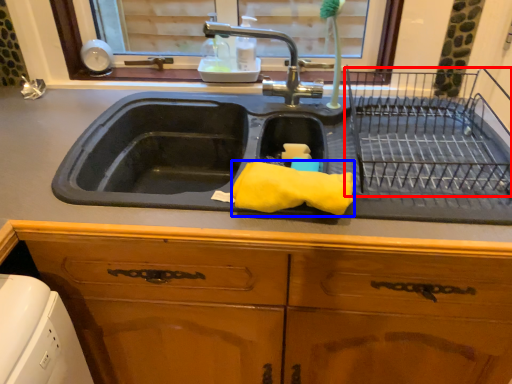
Question: Which object is further to the camera taking this photo, cage (highlighted by a red box) or material (highlighted by a blue box)?

Choices:
 (A) cage
 (B) material

Answer: (B)